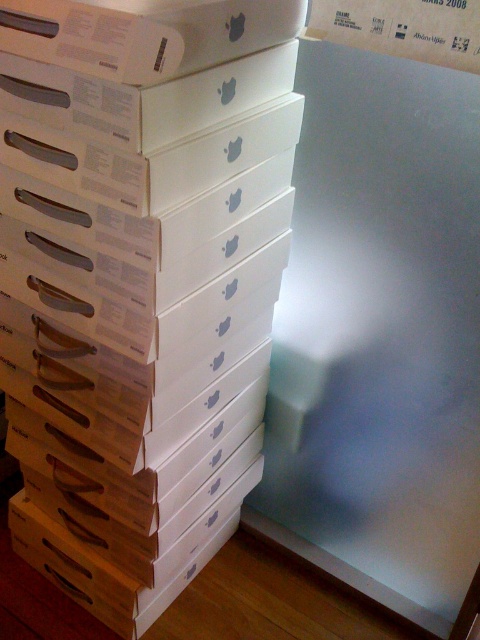
You are moving these MacBook boxes and need to place a new box between the white cardboard boxes at center and the white cardboard box at upper center. Which box should you place the new box below to maintain the size order?

You should place the new box below the white cardboard box at upper center because the white cardboard boxes at center are wider than the white cardboard box at upper center, so the new box should follow the descending size order from bottom to top.

You are organizing a warehouse and need to know the height difference between the white cardboard boxes at center and the white cardboard box at upper center. Which one is taller?

The white cardboard boxes at center is taller than the white cardboard box at upper center according to the description.

You are organizing a storage room and need to know the stacking order of the boxes. Based on the image, which white cardboard box is positioned lower between the white cardboard boxes at center and the white cardboard box at upper center?

The white cardboard boxes at center is positioned lower than the white cardboard box at upper center because it is stated that the white cardboard boxes at center is below white cardboard box at upper center.